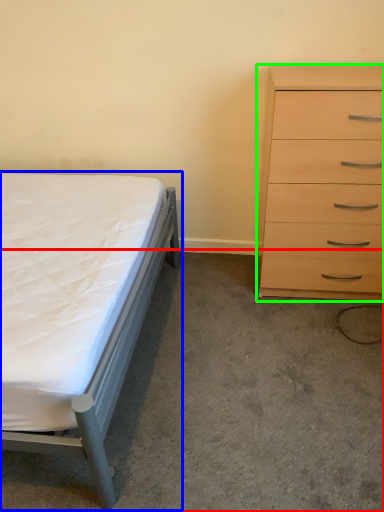
Question: Based on their relative distances, which object is farther from concrete (highlighted by a red box)? Choose from bed (highlighted by a blue box) and chest of drawers (highlighted by a green box).

Choices:
 (A) bed
 (B) chest of drawers

Answer: (B)